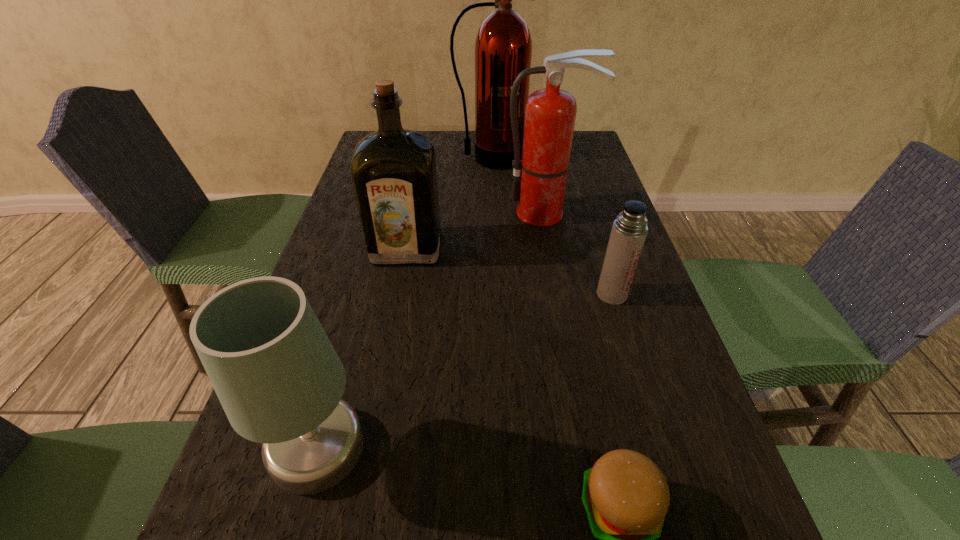
You are a GUI agent. You are given a task and a screenshot of the screen. Output one action in this format:
    pyautogui.click(x=<x>, y=<y>)
    Task: Click on the free space at the right edge
    
    Given the screenshot: What is the action you would take?
    pyautogui.click(x=593, y=287)

Find the location of `vacant area that lies between the fifth nearest object and the lampshade`. vacant area that lies between the fifth nearest object and the lampshade is located at coordinates (432, 330).

Locate an element on the screen. empty space that is in between the third farthest object and the tallest object is located at coordinates (448, 203).

You are a GUI agent. You are given a task and a screenshot of the screen. Output one action in this format:
    pyautogui.click(x=<x>, y=<y>)
    Task: Click on the vacant space that is in between the tallest object and the thermos bottle
    
    Given the screenshot: What is the action you would take?
    pyautogui.click(x=551, y=226)

Identify the location of empty space that is in between the taller fire extinguisher and the liquor. (448, 203).

Identify the location of blank region between the third shortest object and the third farthest object. The image size is (960, 540). (362, 348).

Find the location of a particular element. vacant area between the thermos bottle and the shorter fire extinguisher is located at coordinates (579, 254).

Locate which object is the fourth closest to the fifth nearest object. Please provide its 2D coordinates. Your answer should be formatted as a tuple, i.e. [(x, y)], where the tuple contains the x and y coordinates of a point satisfying the conditions above.

[(277, 376)]

Select which object appears as the fifth closest to the fifth nearest object. Please provide its 2D coordinates. Your answer should be formatted as a tuple, i.e. [(x, y)], where the tuple contains the x and y coordinates of a point satisfying the conditions above.

[(626, 497)]

Where is `blank space that satisfies the following two spatial constraints: 1. on the front-facing side of the tallest object; 2. on the base of the third shortest object`? Image resolution: width=960 pixels, height=540 pixels. blank space that satisfies the following two spatial constraints: 1. on the front-facing side of the tallest object; 2. on the base of the third shortest object is located at coordinates (500, 447).